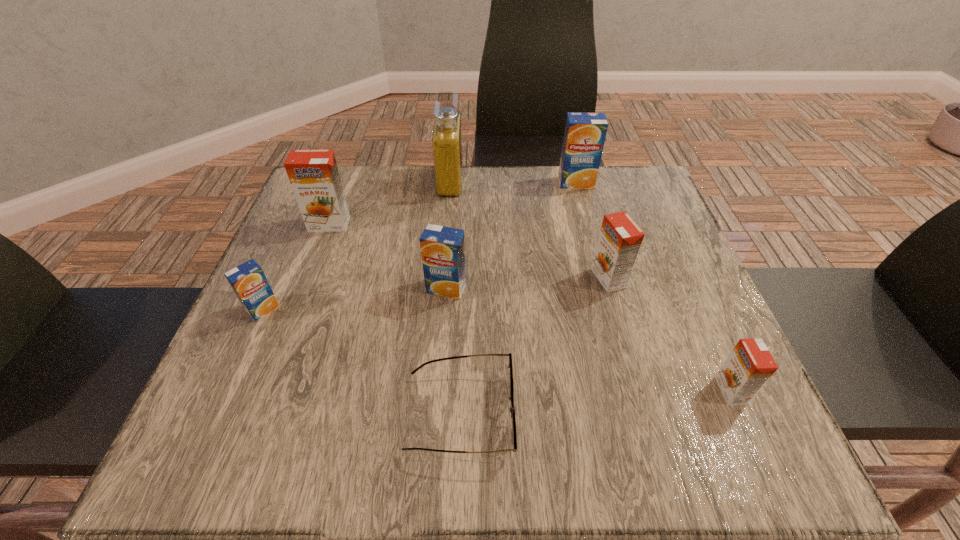
The image size is (960, 540). What are the coordinates of `the tallest object` in the screenshot? It's located at (447, 149).

Image resolution: width=960 pixels, height=540 pixels. Find the location of `the farthest orange juice`. the farthest orange juice is located at coordinates (585, 133).

Locate an element on the screen. the biggest blue orange_juice is located at coordinates (585, 133).

At what (x,y) coordinates should I click in order to perform the action: click on the leftmost orange orange juice. Please return your answer as a coordinate pair (x, y). Looking at the image, I should click on (313, 174).

Image resolution: width=960 pixels, height=540 pixels. Identify the location of the third farthest object. (313, 174).

Where is `the second farthest orange orange juice`? the second farthest orange orange juice is located at coordinates (620, 238).

I want to click on the second biggest orange orange juice, so pos(620,238).

Where is `the second blue orange_juice from left to right`? This screenshot has width=960, height=540. the second blue orange_juice from left to right is located at coordinates [x=442, y=248].

In order to click on the fourth orange juice from right to left in this screenshot , I will do `click(442, 248)`.

Where is `the smallest blue orange_juice`? This screenshot has width=960, height=540. the smallest blue orange_juice is located at coordinates (248, 281).